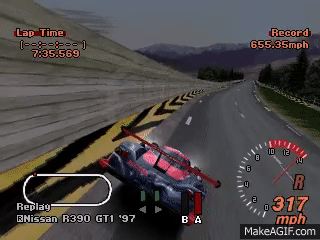
Locate an element on the screen. wall is located at coordinates (60, 87).